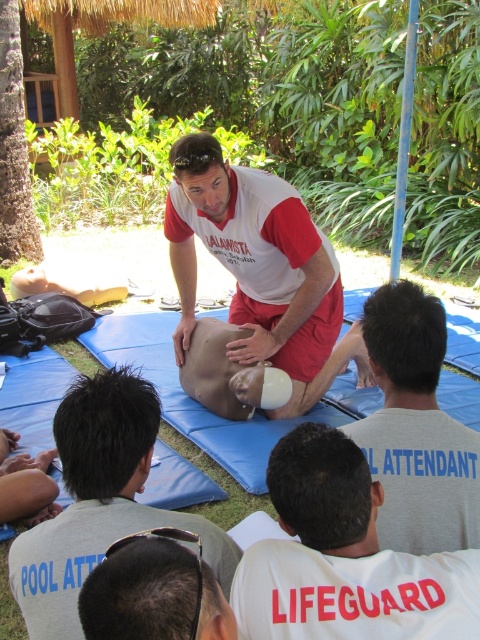
Question: Can you confirm if white/red material/texture shirt at center is thinner than black matte sunglasses at lower center?

Choices:
 (A) no
 (B) yes

Answer: (A)

Question: Which object appears closest to the camera in this image?

Choices:
 (A) matte white torso at center
 (B) gray matte lifeguard shirt at center
 (C) white/red material/texture shirt at center
 (D) black matte sunglasses at lower center

Answer: (D)

Question: Among these points, which one is farthest from the camera?

Choices:
 (A) (253, 340)
 (B) (451, 500)

Answer: (A)

Question: Is white/red material/texture shirt at center to the left of gray matte lifeguard shirt at center from the viewer's perspective?

Choices:
 (A) no
 (B) yes

Answer: (B)

Question: Which object is positioned farthest from the black matte sunglasses at lower center?

Choices:
 (A) white cotton shirt at center
 (B) white/red material/texture shirt at center
 (C) matte white torso at center
 (D) gray matte lifeguard shirt at center

Answer: (B)

Question: In this image, where is white/red material/texture shirt at center located relative to matte white torso at center?

Choices:
 (A) above
 (B) below

Answer: (A)